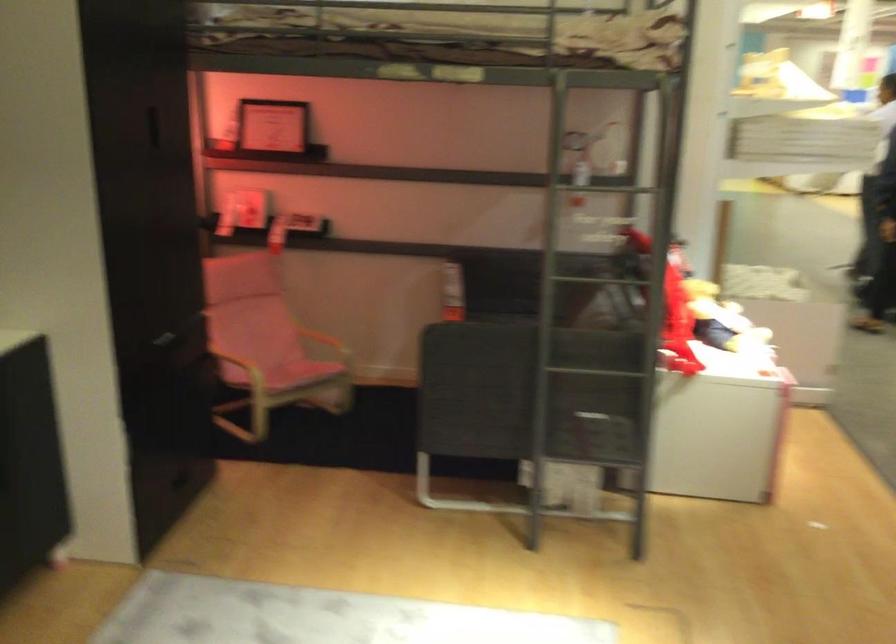
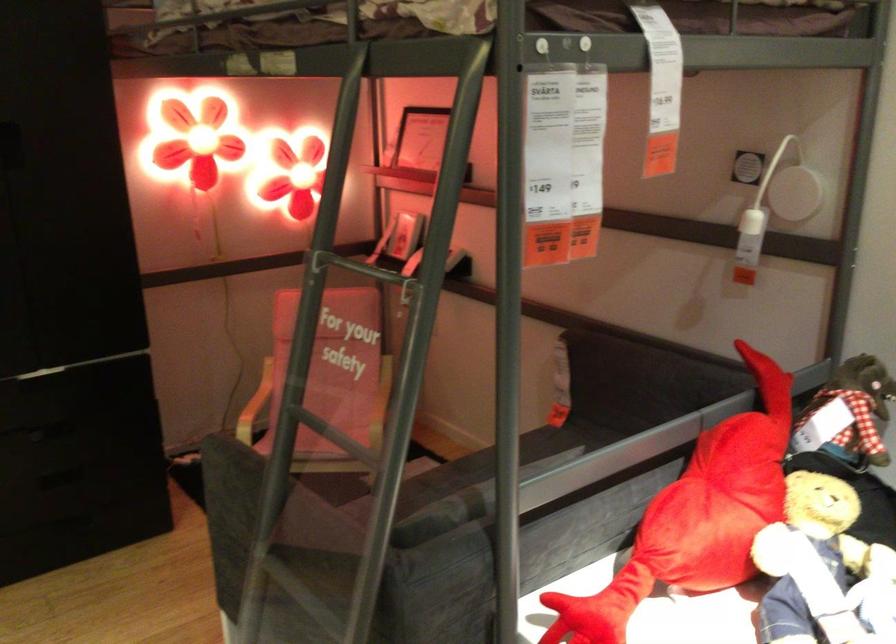
The point at (693, 289) is marked in the first image. Where is the corresponding point in the second image?

(719, 502)